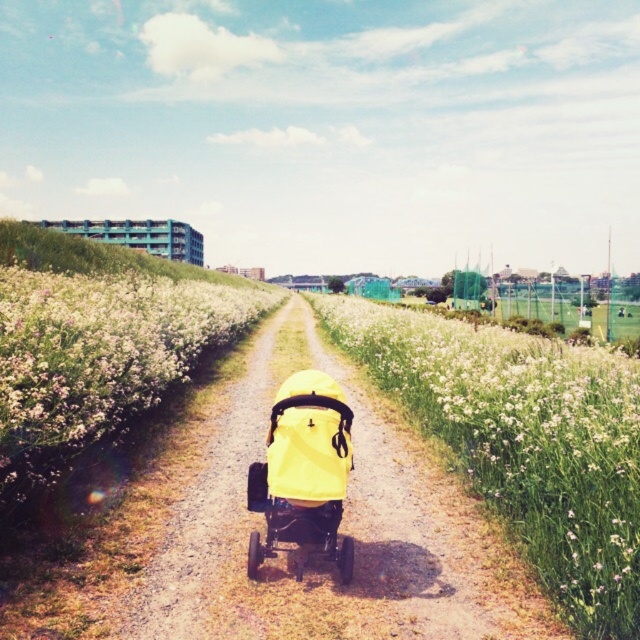
Question: Does yellow fabric stroller at center have a larger size compared to yellow matte baby carriage at center?

Choices:
 (A) no
 (B) yes

Answer: (B)

Question: In this image, where is yellow fabric stroller at center located relative to white fluffy flower at left?

Choices:
 (A) above
 (B) below

Answer: (B)

Question: Which point appears closest to the camera in this image?

Choices:
 (A) (64, 312)
 (B) (320, 440)
 (C) (560, 524)

Answer: (B)

Question: Among these objects, which one is farthest from the camera?

Choices:
 (A) yellow matte baby carriage at center
 (B) white fluffy flower at left

Answer: (B)

Question: Which point is closer to the camera?

Choices:
 (A) (499, 346)
 (B) (33, 403)
 (C) (252, 499)

Answer: (B)

Question: From the image, what is the correct spatial relationship of yellow fabric stroller at center in relation to yellow matte baby carriage at center?

Choices:
 (A) left
 (B) right

Answer: (B)